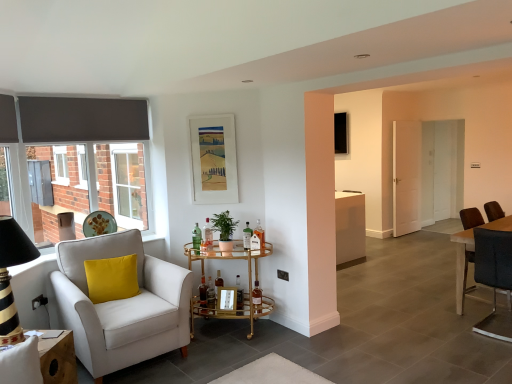
Question: Considering the relative positions of translucent glass bottle at center, placed as the 8th bottle when sorted from left to right, and matte paper picture frame at upper center, the 2th picture frame in the top-to-bottom sequence, in the image provided, is translucent glass bottle at center, placed as the 8th bottle when sorted from left to right, to the left or to the right of matte paper picture frame at upper center, the 2th picture frame in the top-to-bottom sequence,?

Choices:
 (A) right
 (B) left

Answer: (A)

Question: Considering their positions, is translucent glass bottle at center, placed as the 8th bottle when sorted from left to right, located in front of or behind matte paper picture frame at upper center, the 1th picture frame in the left-to-right sequence?

Choices:
 (A) front
 (B) behind

Answer: (A)

Question: Estimate the real-world distances between objects in this image. Which object is closer to the translucent glass bottle at center, marked as the 9th bottle in a left-to-right arrangement?

Choices:
 (A) black leather chair at right, which is the first chair in right-to-left order
 (B) green matte plant at center
 (C) white wooden door at right
 (D) translucent glass bottle at center, which is the fourth bottle in left-to-right order
 (E) translucent glass bottle at center, marked as the second bottle in a left-to-right arrangement

Answer: (B)

Question: Considering the real-world distances, which object is farthest from the green glass bottle at center, the first bottle when ordered from left to right?

Choices:
 (A) matte paper picture frame at upper center, the first picture frame from the bottom
 (B) yellow velvet pillow at left
 (C) white wooden door at right
 (D) black leather chair at right, positioned as the second chair in left-to-right order
 (E) white fabric armchair at left, arranged as the 2th chair when viewed from the right

Answer: (C)